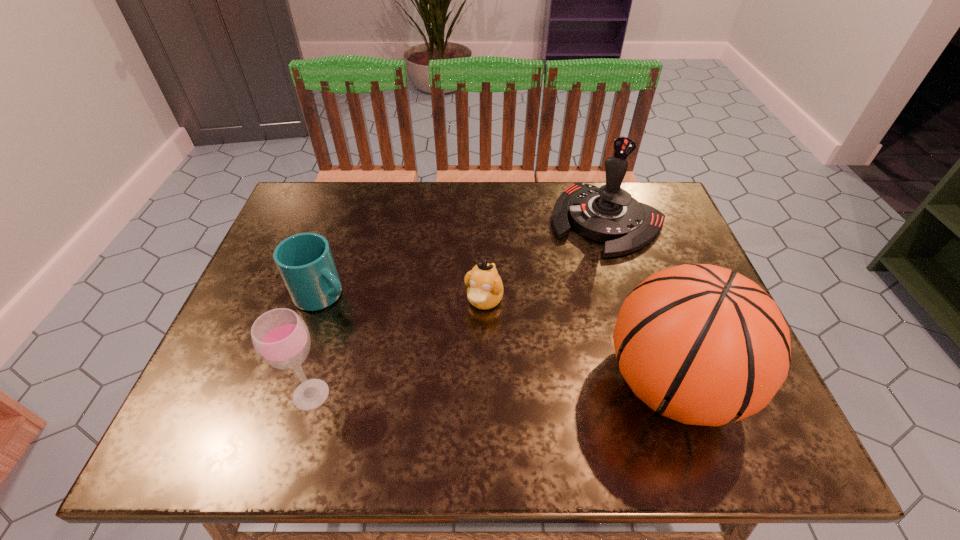
What are the coordinates of `joystick positioned at the right edge` in the screenshot? It's located at (609, 214).

You are a GUI agent. You are given a task and a screenshot of the screen. Output one action in this format:
    pyautogui.click(x=<x>, y=<y>)
    Task: Click on the object situated at the far right corner
    
    Given the screenshot: What is the action you would take?
    pyautogui.click(x=609, y=214)

Where is `object present at the near right corner`? The height and width of the screenshot is (540, 960). object present at the near right corner is located at coordinates (702, 345).

Where is `vacant space at the far edge of the desktop`? vacant space at the far edge of the desktop is located at coordinates (367, 194).

At what (x,y) coordinates should I click in order to perform the action: click on vacant space at the near edge of the desktop. Please return your answer as a coordinate pair (x, y). The height and width of the screenshot is (540, 960). Looking at the image, I should click on (577, 379).

You are a GUI agent. You are given a task and a screenshot of the screen. Output one action in this format:
    pyautogui.click(x=<x>, y=<y>)
    Task: Click on the vacant space at the left edge of the desktop
    This screenshot has height=540, width=960.
    Given the screenshot: What is the action you would take?
    pyautogui.click(x=268, y=251)

Locate an element on the screen. free space at the far left corner of the desktop is located at coordinates (308, 221).

Where is `free point between the duckling and the farthest object`? Image resolution: width=960 pixels, height=540 pixels. free point between the duckling and the farthest object is located at coordinates click(545, 260).

Find the location of `free space between the farthest object and the duckling`. free space between the farthest object and the duckling is located at coordinates (545, 260).

You are a GUI agent. You are given a task and a screenshot of the screen. Output one action in this format:
    pyautogui.click(x=<x>, y=<y>)
    Task: Click on the free area in between the basketball and the wineglass
    This screenshot has height=540, width=960.
    Given the screenshot: What is the action you would take?
    pyautogui.click(x=492, y=389)